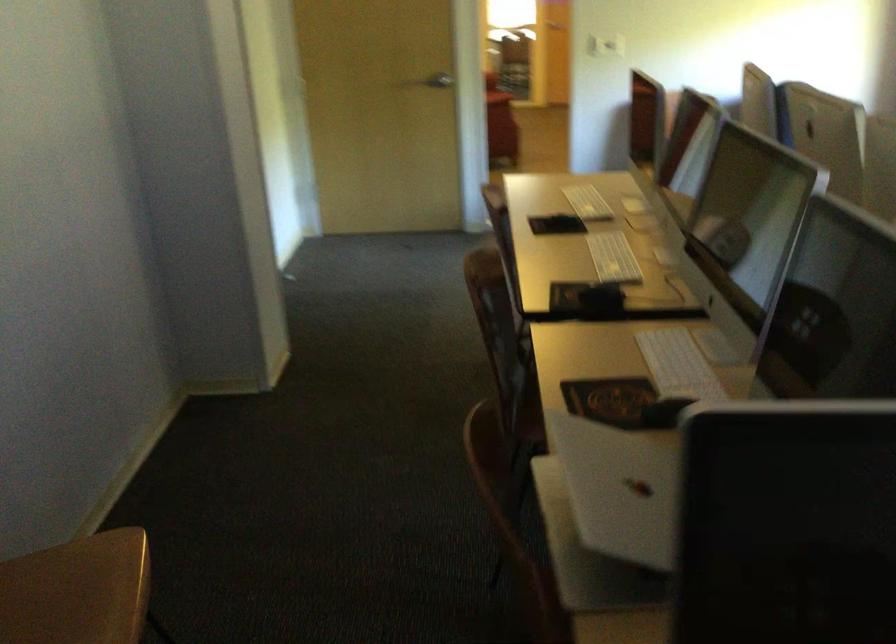
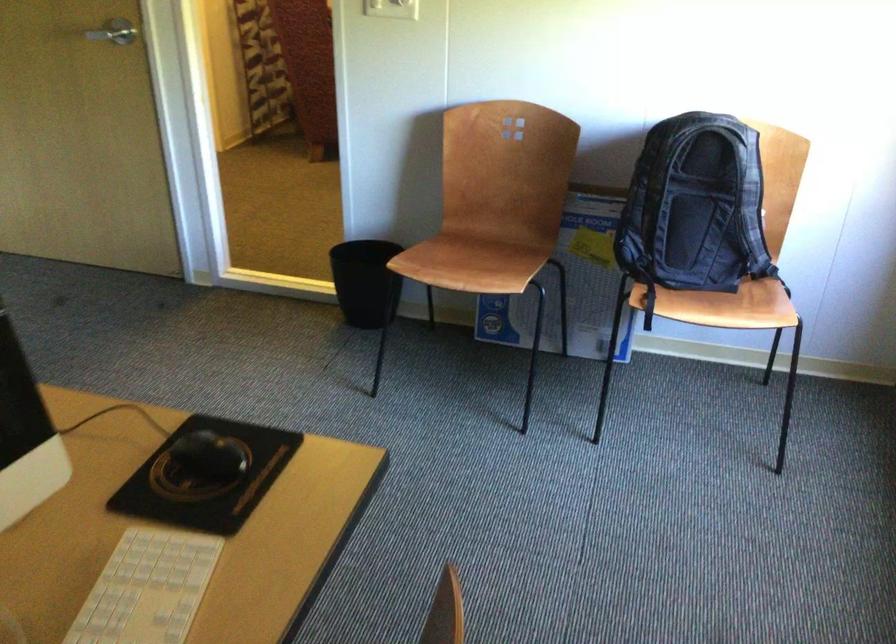
What movement of the cameraman would produce the second image?

The movement direction of the cameraman is right, forward.